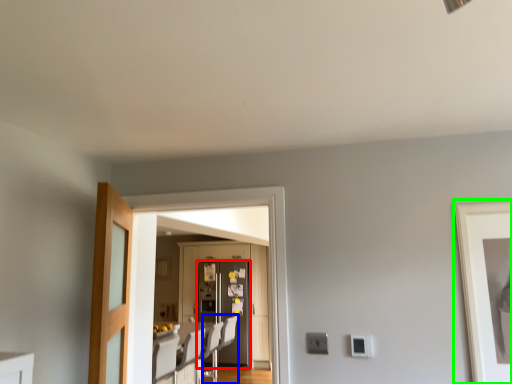
Question: Based on their relative distances, which object is farther from refrigerator (highlighted by a red box)? Choose from swivel chair (highlighted by a blue box) and picture frame (highlighted by a green box).

Choices:
 (A) swivel chair
 (B) picture frame

Answer: (B)